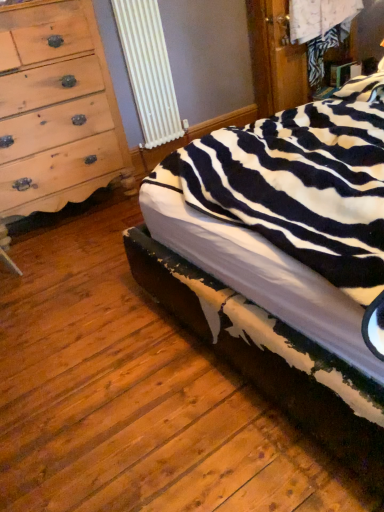
Question: From the image's perspective, is zebra-patterned fabric bed at center positioned above or below light brown wood chest of drawers at left?

Choices:
 (A) below
 (B) above

Answer: (A)

Question: From a real-world perspective, is zebra-patterned fabric bed at center positioned above or below light brown wood chest of drawers at left?

Choices:
 (A) above
 (B) below

Answer: (B)

Question: Based on their sizes in the image, would you say zebra-patterned fabric bed at center is bigger or smaller than light brown wood chest of drawers at left?

Choices:
 (A) small
 (B) big

Answer: (B)

Question: Based on their positions, is light brown wood chest of drawers at left located to the left or right of zebra-patterned fabric bed at center?

Choices:
 (A) left
 (B) right

Answer: (A)

Question: From a real-world perspective, relative to zebra-patterned fabric bed at center, is light brown wood chest of drawers at left vertically above or below?

Choices:
 (A) below
 (B) above

Answer: (B)

Question: Is light brown wood chest of drawers at left situated inside zebra-patterned fabric bed at center or outside?

Choices:
 (A) outside
 (B) inside

Answer: (A)

Question: In terms of height, does light brown wood chest of drawers at left look taller or shorter compared to zebra-patterned fabric bed at center?

Choices:
 (A) short
 (B) tall

Answer: (B)